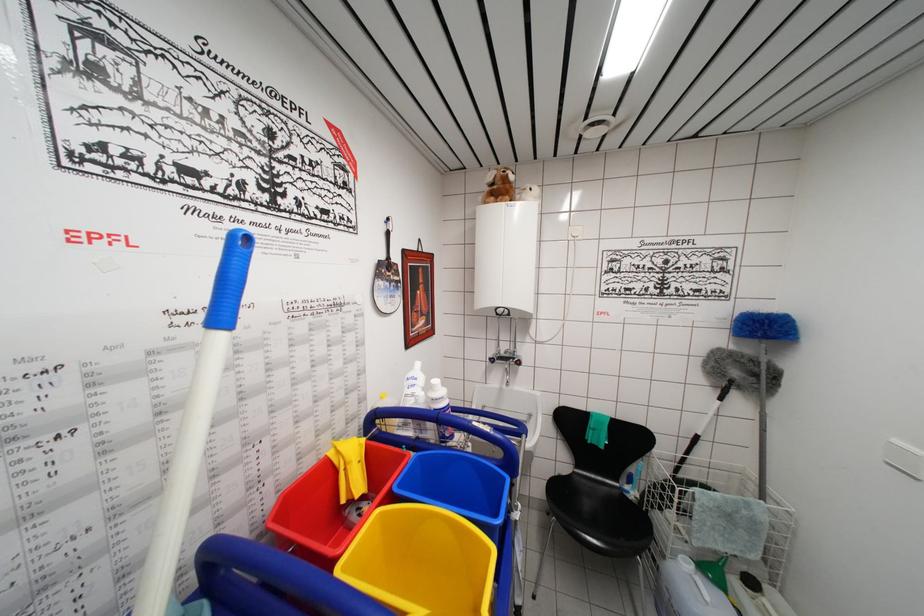
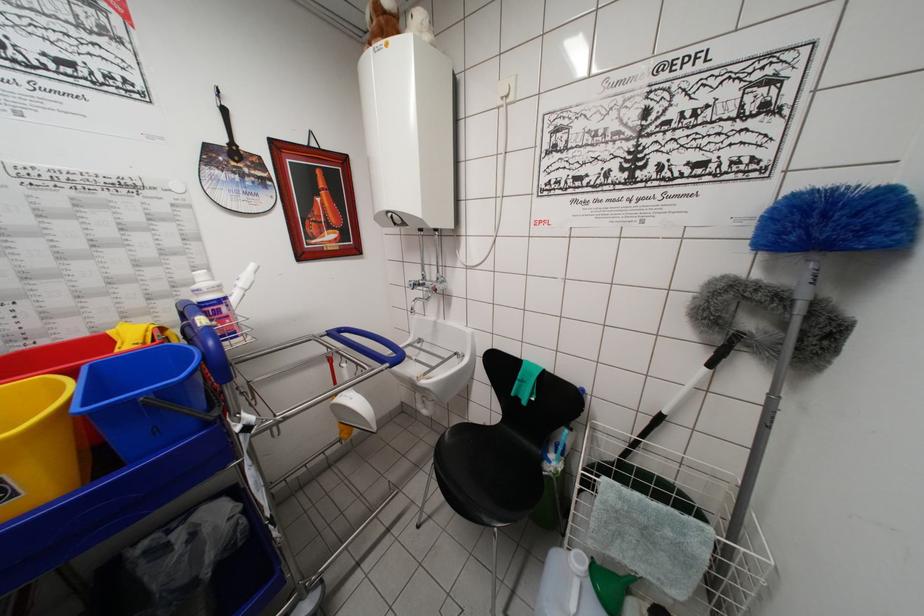
In the second image, find the point that corresponds to point 514,187 in the first image.

(387, 17)